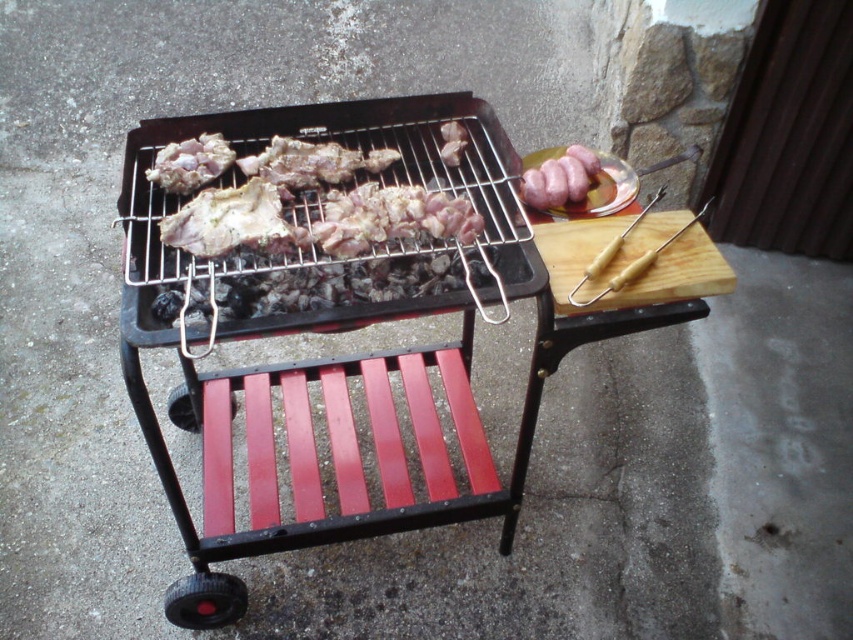
You are preparing to cook the pink glossy sausages at upper right and the pinkish matte meat at center. Which one requires more cooking time based on their size?

The pink glossy sausages at upper right requires more cooking time because it is bigger than the pinkish matte meat at center.

You are preparing to cook food and see the pink glossy sausages at upper right and the pinkish matte meat at center. Which one has a greater width?

The pink glossy sausages at upper right has a greater width than the pinkish matte meat at center.

You are a chef preparing food for a barbecue. You need to place the pinkish matte meat at center onto the black metal grill at center. Which object should you move first to make space?

The black metal grill at center is in front of the pinkish matte meat at center, so you should move the pinkish matte meat at center first to make space on the black metal grill at center.